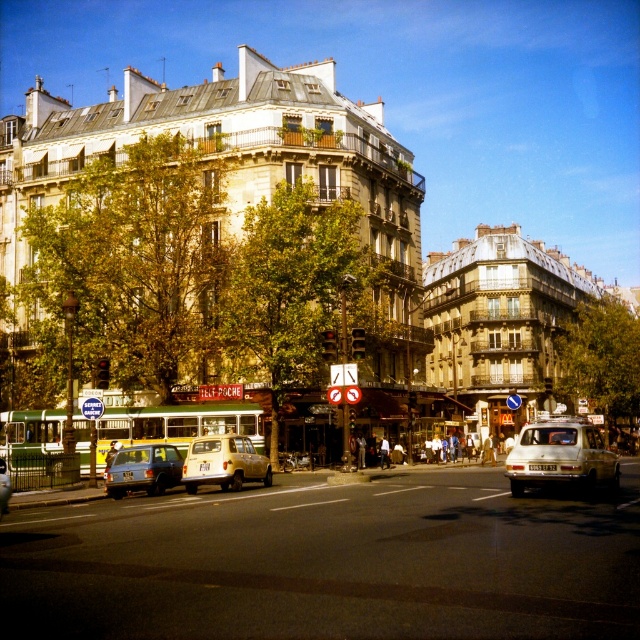
You are standing on the street and want to walk from point (253, 476) to point (156, 454). Which direction should you move in relative to your current position?

Since point (253, 476) is closer to you than point (156, 454), you should move forward to reach it.

You are a delivery person who needs to park your 2.5 meters tall truck behind the green matte bus at center. Can your truck fit under the overhead bridge that the metallic silver car at lower left is parked under?

The green matte bus at center is taller than metallic silver car at lower left. Since the truck is 2.5 meters tall, it can only fit under the bridge if the metallic silver car at lower left can also pass. However, since the bus is taller than the car, if the bridge allows the bus to pass, the truck should also fit as it is shorter than the bus.

You are a delivery driver navigating through the city. Your GPS shows your current position as point 0.725, 0.350. You need to turn left at the next intersection. Is the light beige matte suv at center blocking your path?

The light beige matte suv at center is located at point [224,464], which matches your current GPS position. This means the vehicle is where you are, so it is not blocking your path. Proceed with caution.